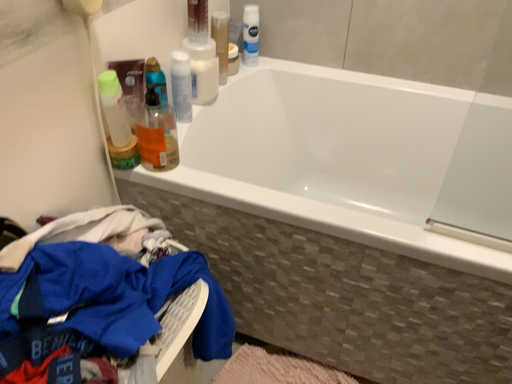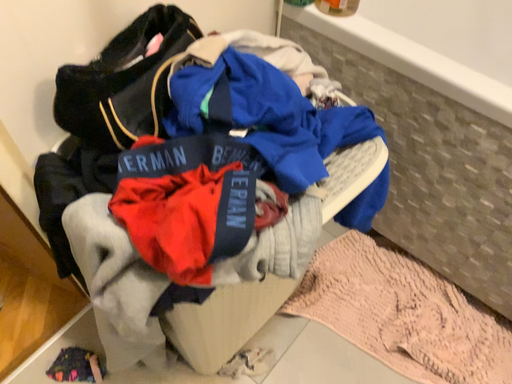
Question: Which way did the camera rotate in the video?

Choices:
 (A) rotated right
 (B) rotated left

Answer: (B)